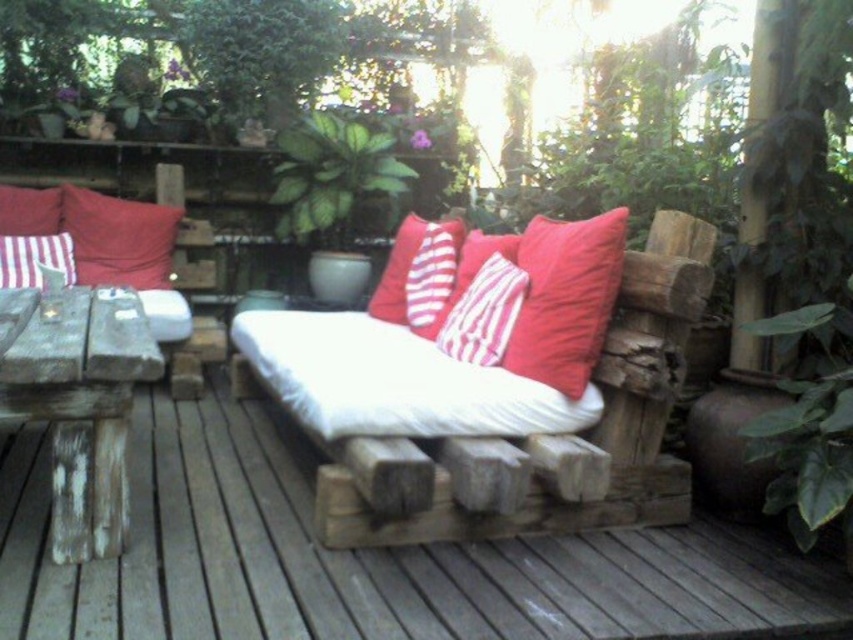
Question: Which object appears closest to the camera in this image?

Choices:
 (A) green leafy plant at center
 (B) green leafy plant at lower right

Answer: (B)

Question: Does red striped cushion at center have a smaller size compared to matte red pillow at left?

Choices:
 (A) yes
 (B) no

Answer: (B)

Question: Estimate the real-world distances between objects in this image. Which object is closer to the white matte bench at center?

Choices:
 (A) matte wooden couch at left
 (B) weathered wood deck at center
 (C) striped cotton pillow at center
 (D) white striped pillow at upper left

Answer: (C)

Question: Is red cotton cushion at center thinner than matte red pillow at upper left?

Choices:
 (A) yes
 (B) no

Answer: (A)

Question: Is red cotton cushion at center wider than white striped pillow at upper left?

Choices:
 (A) yes
 (B) no

Answer: (A)

Question: Which object is positioned farthest from the weathered wood table at left?

Choices:
 (A) matte red pillow at left
 (B) red cotton cushion at center

Answer: (A)